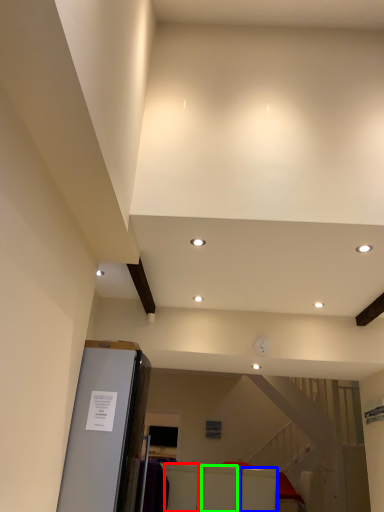
Question: Considering the real-world distances, which object is closest to furniture (highlighted by a red box)? furniture (highlighted by a blue box) or furniture (highlighted by a green box).

Choices:
 (A) furniture
 (B) furniture

Answer: (B)